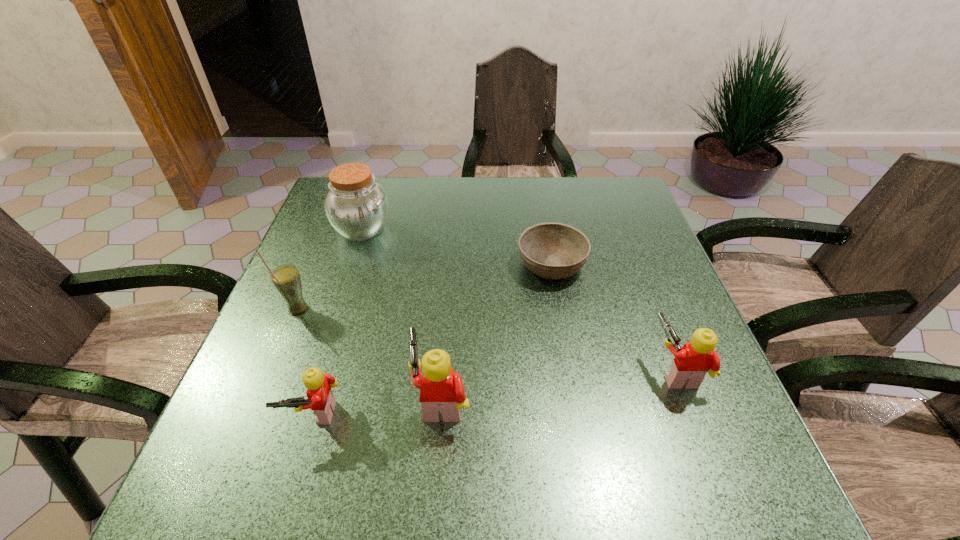
The height and width of the screenshot is (540, 960). I want to click on straw for drinking present at the left edge, so click(286, 279).

Find the location of a particular element. This screenshot has width=960, height=540. jar at the left edge is located at coordinates (357, 207).

At what (x,y) coordinates should I click in order to perform the action: click on object that is at the right edge. Please return your answer as a coordinate pair (x, y). This screenshot has height=540, width=960. Looking at the image, I should click on (691, 363).

Find the location of a particular element. This screenshot has height=540, width=960. object at the far left corner is located at coordinates (357, 207).

Identify the location of object that is at the near left corner. The image size is (960, 540). (321, 400).

The width and height of the screenshot is (960, 540). What are the coordinates of `object that is at the near right corner` in the screenshot? It's located at (691, 363).

Find the location of a particular element. The height and width of the screenshot is (540, 960). free location at the far edge of the desktop is located at coordinates (484, 216).

In the image, there is a desktop. Identify the location of vacant space at the near edge. The width and height of the screenshot is (960, 540). (612, 422).

I want to click on vacant space at the left edge of the desktop, so click(x=337, y=292).

Identify the location of blank space at the right edge of the desktop. (644, 334).